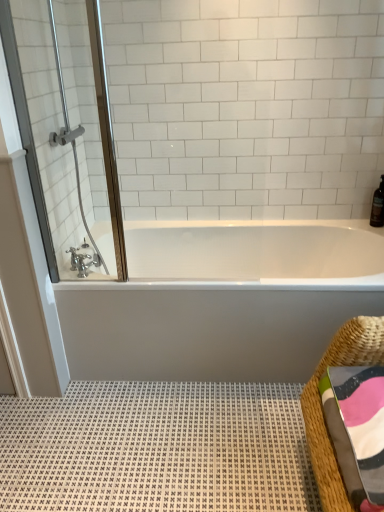
Question: Considering the positions of brushed metal faucet at lower left and white textured bath mat at lower center in the image, is brushed metal faucet at lower left taller or shorter than white textured bath mat at lower center?

Choices:
 (A) tall
 (B) short

Answer: (A)

Question: In the image, is brushed metal faucet at lower left positioned in front of or behind white textured bath mat at lower center?

Choices:
 (A) behind
 (B) front

Answer: (A)

Question: Estimate the real-world distances between objects in this image. Which object is closer to the white textured bath mat at lower center?

Choices:
 (A) white glossy bathtub at center
 (B) clear glass shower door at upper left
 (C) brown glass bottle at upper right
 (D) woven straw basket at lower right
 (E) brushed metal faucet at lower left

Answer: (A)

Question: Which is farther from the multicolored woven towel at lower right?

Choices:
 (A) woven straw basket at lower right
 (B) white textured bath mat at lower center
 (C) brown glass bottle at upper right
 (D) brushed metal faucet at lower left
 (E) clear glass shower door at upper left

Answer: (E)